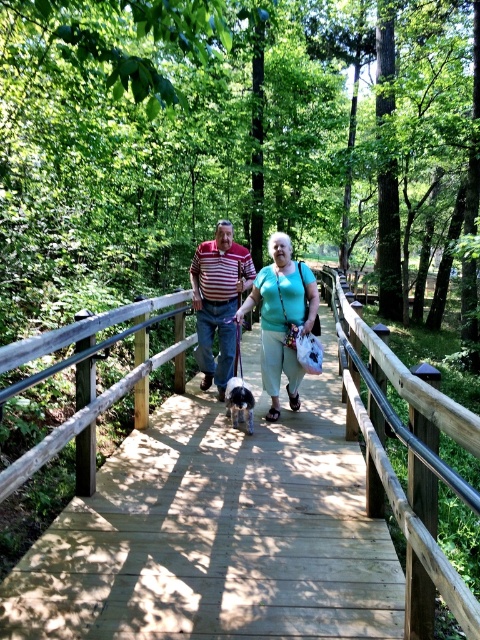
Question: Which of the following is the farthest from the observer?

Choices:
 (A) pyautogui.click(x=231, y=403)
 (B) pyautogui.click(x=201, y=440)

Answer: (A)

Question: Which of the following is the closest to the observer?

Choices:
 (A) (242, 380)
 (B) (203, 266)

Answer: (A)

Question: Is striped cotton shirt at center above fluffy white dog at center?

Choices:
 (A) no
 (B) yes

Answer: (B)

Question: Can you confirm if striped cotton shirt at center is bigger than fluffy white dog at center?

Choices:
 (A) no
 (B) yes

Answer: (B)

Question: Is the position of green matte shirt at center more distant than that of striped cotton shirt at center?

Choices:
 (A) no
 (B) yes

Answer: (A)

Question: Which of the following is the farthest from the observer?

Choices:
 (A) wooden bridge at center
 (B) green matte shirt at center
 (C) striped cotton shirt at center

Answer: (C)